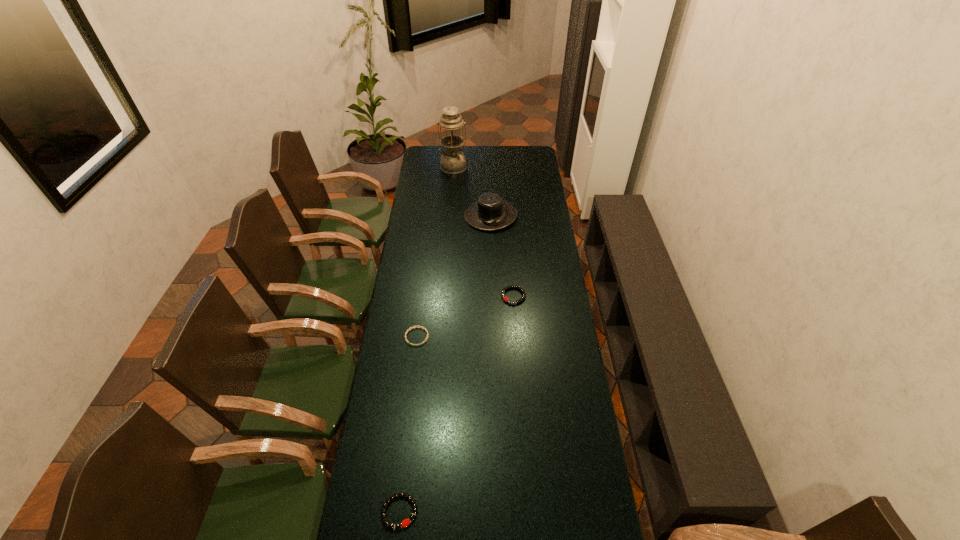
In the image, there is a desktop. In order to click on vacant space at the far left corner in this screenshot , I will do `click(435, 158)`.

This screenshot has height=540, width=960. Identify the location of free space that is in between the shortest bracelet and the fourth nearest object. (454, 276).

Find the location of a particular element. This screenshot has width=960, height=540. free space between the nearest bracelet and the fourth nearest object is located at coordinates (445, 363).

Find the location of a particular element. free area in between the farthest object and the third farthest object is located at coordinates (484, 232).

Where is `free space that is in between the nearest bracelet and the farthest object`? The height and width of the screenshot is (540, 960). free space that is in between the nearest bracelet and the farthest object is located at coordinates (426, 339).

Where is `free spot between the second tallest object and the farthest bracelet`? The height and width of the screenshot is (540, 960). free spot between the second tallest object and the farthest bracelet is located at coordinates (502, 256).

What are the coordinates of `empty space that is in between the third nearest object and the second nearest bracelet` in the screenshot? It's located at coord(466,316).

Where is `free space between the farthest bracelet and the nearest bracelet`? The width and height of the screenshot is (960, 540). free space between the farthest bracelet and the nearest bracelet is located at coordinates (457, 404).

Identify the location of vacant point located between the rightmost bracelet and the tallest object. (484, 232).

Find the location of `free point between the nearest object and the oil lamp`. free point between the nearest object and the oil lamp is located at coordinates (426, 339).